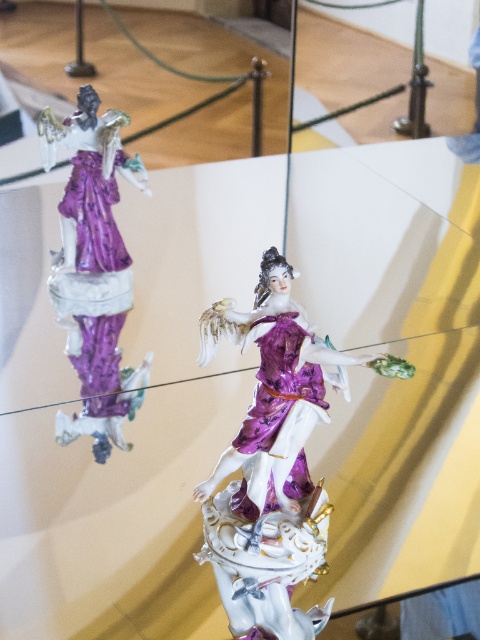
In the scene shown: You are a museum curator planning to install a security camera to monitor the porcelain statue at left. The camera has a field of view that can cover an area up to 0.5 units in radius. Given the statue is at coordinates point 0.416, 0.194, will the camera placed at the center of the room at point 0.5, 0.5 be able to fully capture the statue within its field of view?

The porcelain statue at left is located at point (93, 266). The distance between the camera at (240, 320) and the statue is calculated using the distance formula. The distance squared is 0.0001696 plus 0.092409 equals 0.0925786. Taking the square root gives approximately 0.304 units. Since 0.304 is less than 0.5, the camera can fully capture the statue within its field of view.

You are a museum curator planning to install a spotlight on the porcelain statue at center. The spotlight can only illuminate a circular area with a radius of 0.5 units. Given the coordinates of the porcelain statue at center as point (274, 461), will the spotlight cover the entire statue?

The porcelain statue at center is located at point (274, 461). Since the spotlight has a radius of 0.5 units, it will cover the entire statue as long as the statue fits within the circular area. However, without specific dimensions of the statue, we can confirm the center is within the spotlight range, but the full coverage depends on the statue size relative to the spotlight radius.

You are a visitor in the museum and want to take a photo of the porcelain figurine. You notice two points marked in the image. The first point is at coordinates point [330,355] and the second point is at point [64,125]. Which point is closer to the camera lens?

Point [330,355] is in front of point [64,125], so the first point is closer to the camera lens.